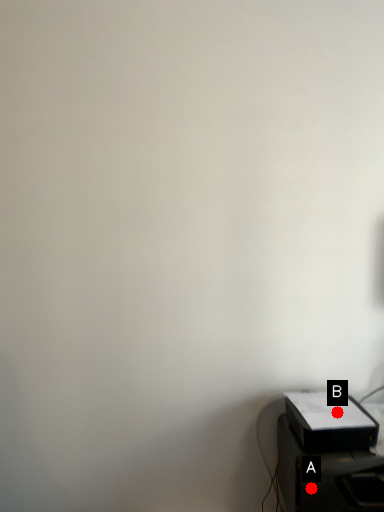
Question: Two points are circled on the image, labeled by A and B beside each circle. Which point is farther from the camera taking this photo?

Choices:
 (A) A is further
 (B) B is further

Answer: (B)